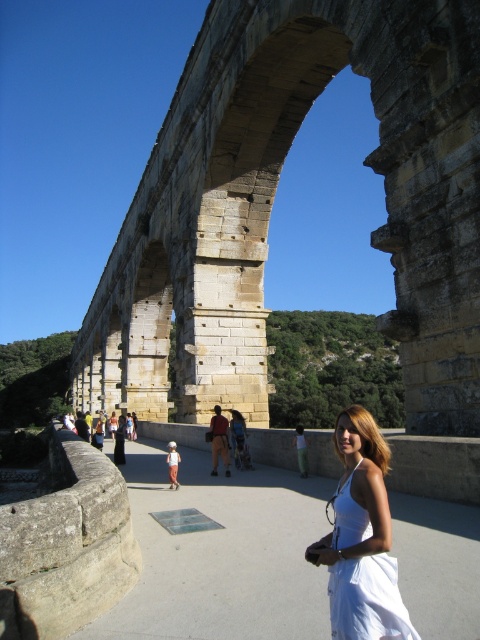
Is white cotton dress at center taller than brown leather jacket at center?

In fact, white cotton dress at center may be shorter than brown leather jacket at center.

Does point (356, 614) come in front of point (225, 442)?

Yes.

At what (x,y) coordinates should I click in order to perform the action: click on white cotton dress at center. Please return your answer as a coordinate pair (x, y). Looking at the image, I should click on (368, 600).

Is point (411, 58) closer to camera compared to point (407, 634)?

That is False.

What do you see at coordinates (272, 204) in the screenshot? The width and height of the screenshot is (480, 640). I see `stone arch bridge at center` at bounding box center [272, 204].

Find the location of a particular element. stone arch bridge at center is located at coordinates (272, 204).

Who is more forward, (384, 228) or (223, 444)?

Point (384, 228) is in front.

Is point (402, 353) more distant than point (226, 436)?

No, (402, 353) is in front of (226, 436).

Does point (225, 374) come closer to viewer compared to point (214, 442)?

No, (225, 374) is further to viewer.

Where is `stone arch bridge at center`? This screenshot has height=640, width=480. stone arch bridge at center is located at coordinates (272, 204).